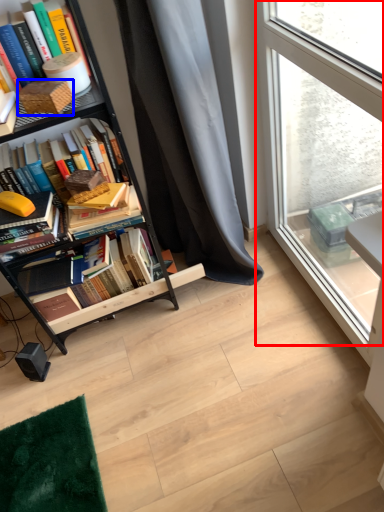
Question: Which point is closer to the camera, window (highlighted by a red box) or paperback book (highlighted by a blue box)?

Choices:
 (A) window
 (B) paperback book

Answer: (A)